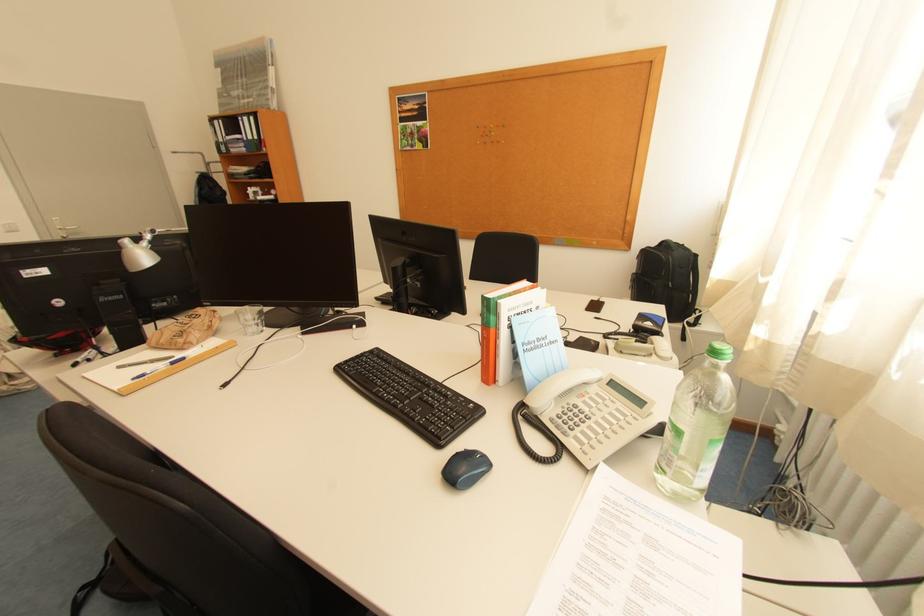
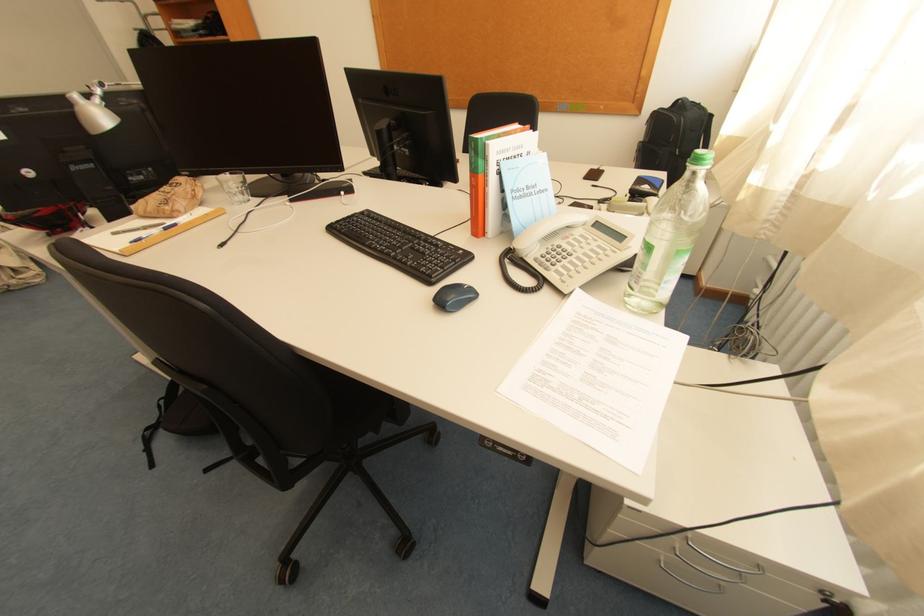
Locate, in the second image, the point that corresponds to the point at 161,233 in the first image.

(110, 86)